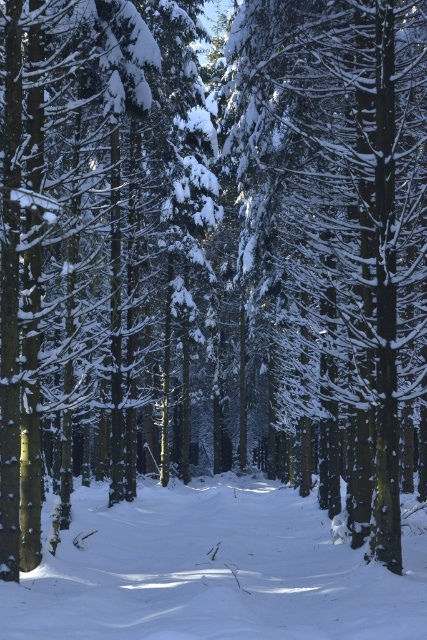
You are standing in the winter forest scene and want to walk from the point at coordinates point (x=272, y=340) to the point at coordinates point (x=66, y=637). Which direction should you move to get closer to your destination?

To move from point (x=272, y=340) to point (x=66, y=637), you should move downward and to the right because point (x=66, y=637) is located lower and further to the right compared to point (x=272, y=340).